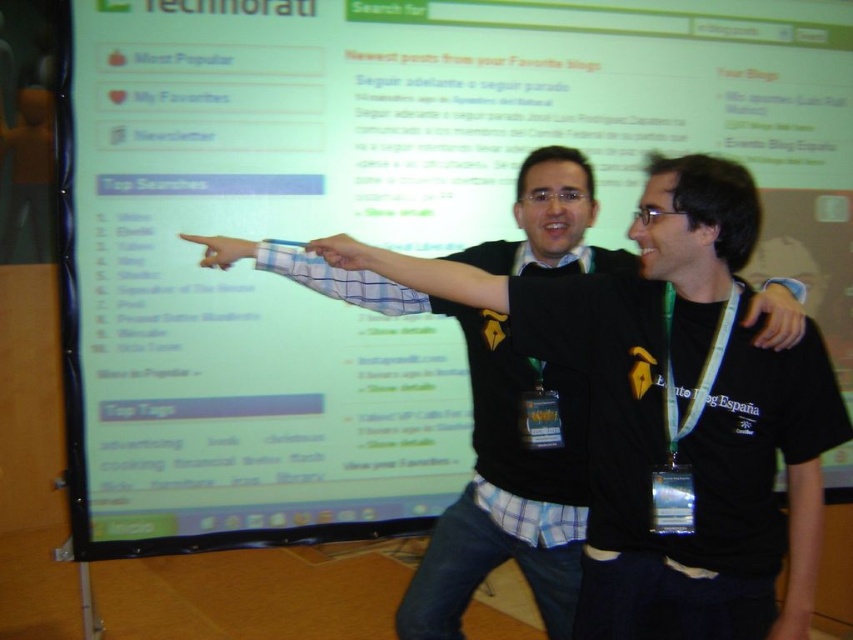
Is point (323, 237) farther from viewer compared to point (190, 237)?

No, (323, 237) is closer to viewer.

Based on the photo, is matte blue shirt at upper center positioned in front of matte blue pen at upper center?

Yes, it is.

The width and height of the screenshot is (853, 640). Identify the location of matte blue shirt at upper center. (344, 252).

This screenshot has width=853, height=640. Identify the location of matte black hand at upper right. (776, 314).

Does matte black hand at upper right have a lesser height compared to matte blue shirt at upper center?

In fact, matte black hand at upper right may be taller than matte blue shirt at upper center.

Who is more distant from viewer, (x=764, y=340) or (x=347, y=268)?

Point (x=347, y=268)

At what (x,y) coordinates should I click in order to perform the action: click on matte black hand at upper right. Please return your answer as a coordinate pair (x, y). This screenshot has height=640, width=853. Looking at the image, I should click on (776, 314).

Who is shorter, matte black hand at upper right or matte blue pen at upper center?

matte blue pen at upper center is shorter.

Does matte black hand at upper right have a smaller size compared to matte blue pen at upper center?

Indeed, matte black hand at upper right has a smaller size compared to matte blue pen at upper center.

Locate an element on the screen. The image size is (853, 640). matte black hand at upper right is located at coordinates (776, 314).